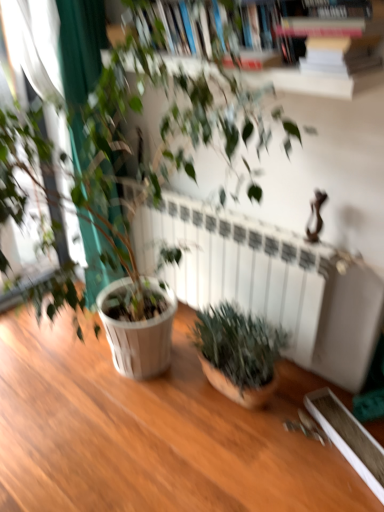
Question: Can you confirm if white matte radiator at center is positioned to the right of green matte plant at center, which is the 1th houseplant in top-to-bottom order?

Choices:
 (A) no
 (B) yes

Answer: (B)

Question: Would you say white matte radiator at center is outside green matte plant at center, which is the 1th houseplant in top-to-bottom order?

Choices:
 (A) yes
 (B) no

Answer: (B)

Question: Is the position of white matte radiator at center more distant than that of green matte plant at center, which is the 1th houseplant in top-to-bottom order?

Choices:
 (A) no
 (B) yes

Answer: (B)

Question: From the image's perspective, is white matte radiator at center on green matte plant at center, which is the 1th houseplant in top-to-bottom order?

Choices:
 (A) no
 (B) yes

Answer: (A)

Question: Considering the relative sizes of white matte radiator at center and green matte plant at center, acting as the second houseplant starting from the bottom, in the image provided, is white matte radiator at center bigger than green matte plant at center, acting as the second houseplant starting from the bottom,?

Choices:
 (A) yes
 (B) no

Answer: (B)

Question: From the image's perspective, relative to wooden bookcase at upper center, is white matte radiator at center above or below?

Choices:
 (A) below
 (B) above

Answer: (A)

Question: Considering the positions of white matte radiator at center and wooden bookcase at upper center in the image, is white matte radiator at center bigger or smaller than wooden bookcase at upper center?

Choices:
 (A) big
 (B) small

Answer: (A)

Question: Is white matte radiator at center in front of or behind wooden bookcase at upper center in the image?

Choices:
 (A) front
 (B) behind

Answer: (B)

Question: Which is correct: white matte radiator at center is inside wooden bookcase at upper center, or outside of it?

Choices:
 (A) inside
 (B) outside

Answer: (B)

Question: Considering their positions, is green matte plant at center, which is the 1th houseplant in top-to-bottom order, located in front of or behind green matte plant at lower right, the second houseplant from the top?

Choices:
 (A) behind
 (B) front

Answer: (B)

Question: Considering the positions of point (120, 70) and point (253, 387), is point (120, 70) closer or farther from the camera than point (253, 387)?

Choices:
 (A) closer
 (B) farther

Answer: (A)

Question: In terms of width, does green matte plant at center, which is the 1th houseplant in top-to-bottom order, look wider or thinner when compared to green matte plant at lower right, positioned as the 1th houseplant in bottom-to-top order?

Choices:
 (A) thin
 (B) wide

Answer: (B)

Question: From a real-world perspective, is green matte plant at center, acting as the second houseplant starting from the bottom, physically located above or below green matte plant at lower right, the second houseplant from the top?

Choices:
 (A) below
 (B) above

Answer: (B)

Question: Is point (304, 17) closer or farther from the camera than point (294, 321)?

Choices:
 (A) closer
 (B) farther

Answer: (A)

Question: Based on their positions, is wooden bookcase at upper center located to the left or right of white matte radiator at center?

Choices:
 (A) left
 (B) right

Answer: (A)